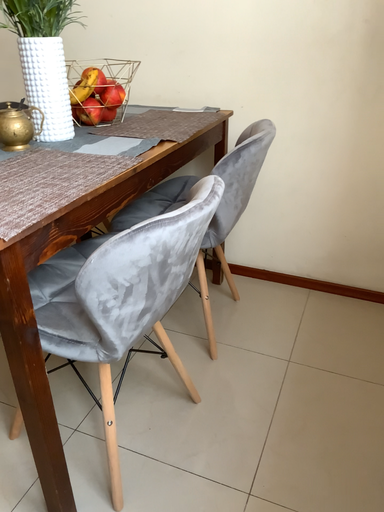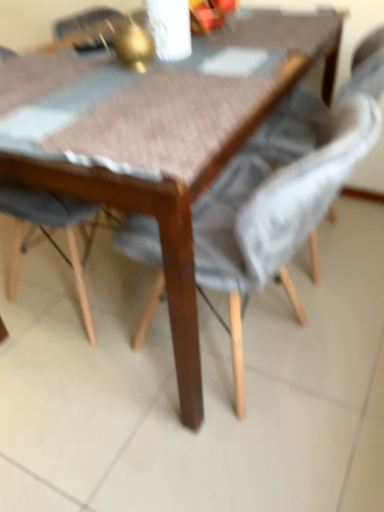
Question: Which way did the camera rotate in the video?

Choices:
 (A) rotated left
 (B) rotated right

Answer: (A)